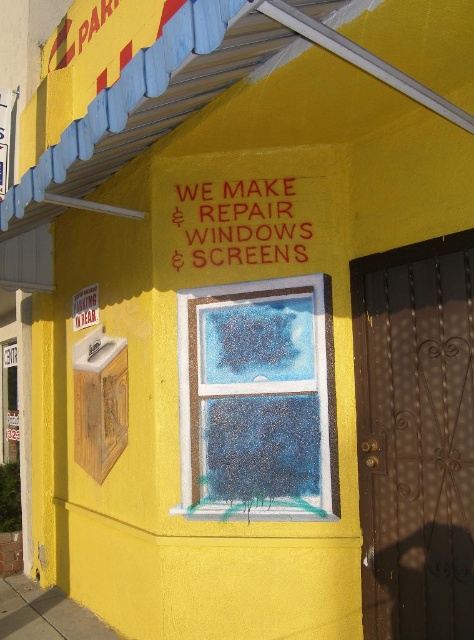
You are a window installer who needs to ensure the new sign will fit above the existing window. Based on the scene description, which object is taller, the blue frosted glass window at center or the red rubber sign at center?

The blue frosted glass window at center is taller than the red rubber sign at center according to the description.

You are a painter who needs to cover the entire surface of both the blue frosted glass window at center and the red rubber sign at center with a protective coating. Which object requires more coating material due to its larger size?

The blue frosted glass window at center requires more coating material because its width surpasses that of the red rubber sign at center, indicating it is larger in size.